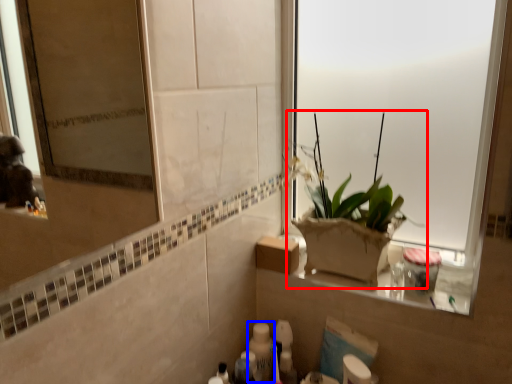
Question: Which point is further to the camera, houseplant (highlighted by a red box) or toiletry (highlighted by a blue box)?

Choices:
 (A) houseplant
 (B) toiletry

Answer: (B)